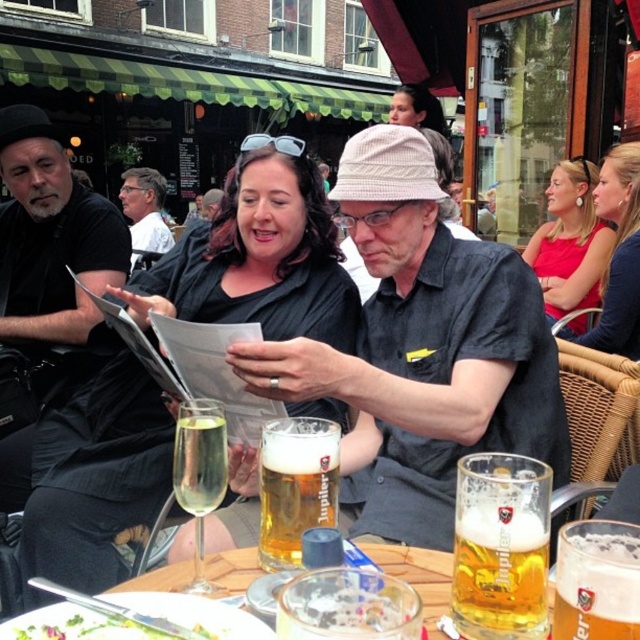
Who is taller, matte red dress at upper right or matte black shirt at center?

Standing taller between the two is matte red dress at upper right.

Does matte red dress at upper right appear over matte black shirt at center?

No.

Which is behind, point (563, 180) or point (410, 116)?

The point (410, 116) is behind.

At what (x,y) coordinates should I click in order to perform the action: click on matte red dress at upper right. Please return your answer as a coordinate pair (x, y). Looking at the image, I should click on (570, 241).

Is point (483, 298) positioned after point (218, 428)?

Yes, point (483, 298) is behind point (218, 428).

Does dark gray shirt at center have a larger size compared to clear glass wine at center?

Yes, dark gray shirt at center is bigger than clear glass wine at center.

Does point (515, 337) come closer to viewer compared to point (204, 429)?

That is False.

Locate an element on the screen. dark gray shirt at center is located at coordinates pos(426,346).

From the picture: Is dark gray shirt at center behind matte black shirt at center?

No.

Which is in front, point (468, 344) or point (435, 125)?

Point (468, 344) is in front.

The height and width of the screenshot is (640, 640). Find the location of `dark gray shirt at center`. dark gray shirt at center is located at coordinates (426, 346).